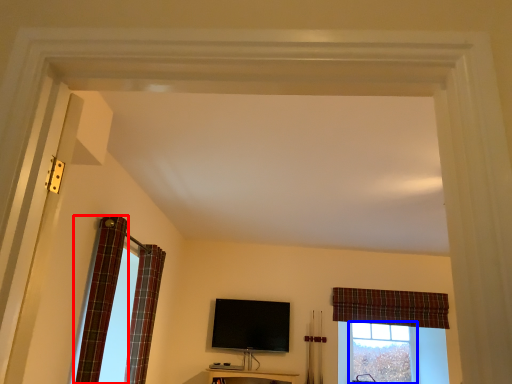
Question: Among these objects, which one is farthest to the camera, curtain (highlighted by a red box) or bay window (highlighted by a blue box)?

Choices:
 (A) curtain
 (B) bay window

Answer: (B)